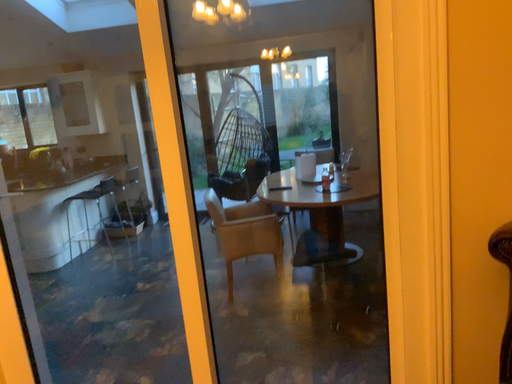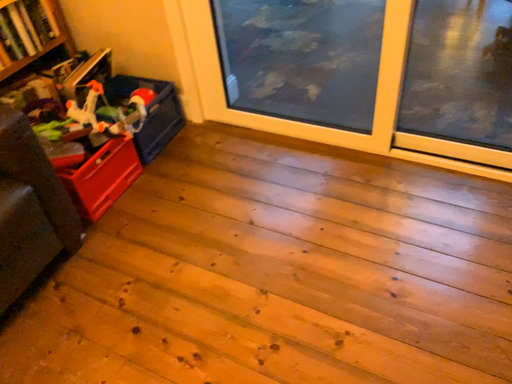
Question: How did the camera likely rotate when shooting the video?

Choices:
 (A) rotated downward
 (B) rotated upward

Answer: (A)